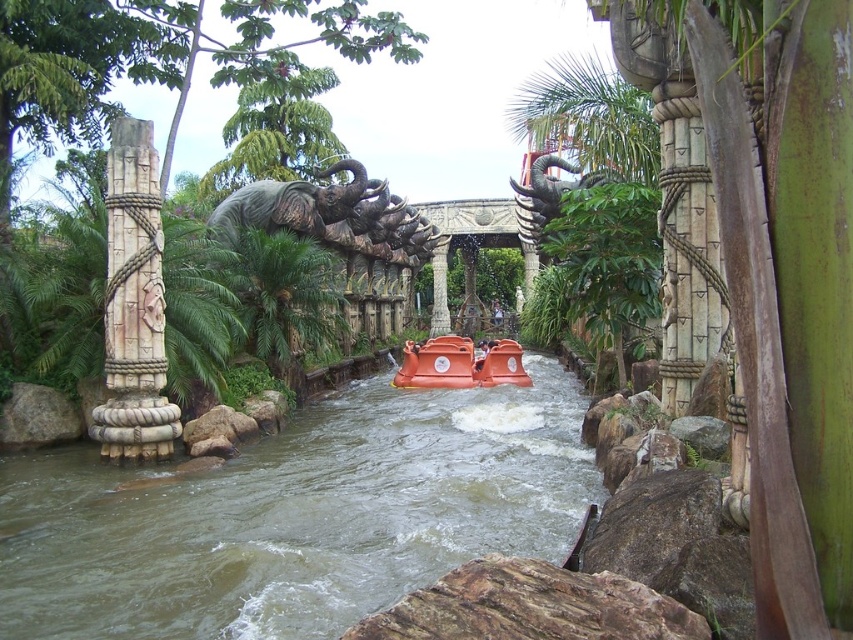
Question: Can you confirm if brown rubber boat at center is positioned to the left of rustic stone elephant at center?

Choices:
 (A) yes
 (B) no

Answer: (B)

Question: Based on their relative distances, which object is nearer to the brown rubber boat at center?

Choices:
 (A) orange matte raft at center
 (B) stone statue at center

Answer: (A)

Question: Is brown rubber boat at center wider than rustic stone elephant at center?

Choices:
 (A) no
 (B) yes

Answer: (B)

Question: Considering the real-world distances, which object is farthest from the brown rubber boat at center?

Choices:
 (A) orange matte raft at center
 (B) rustic stone elephant at center

Answer: (B)

Question: Which of the following is the farthest from the observer?

Choices:
 (A) carved stone column at left
 (B) stone statue at center
 (C) orange matte raft at center

Answer: (B)

Question: Is brown rubber boat at center bigger than rustic stone elephant at center?

Choices:
 (A) yes
 (B) no

Answer: (B)